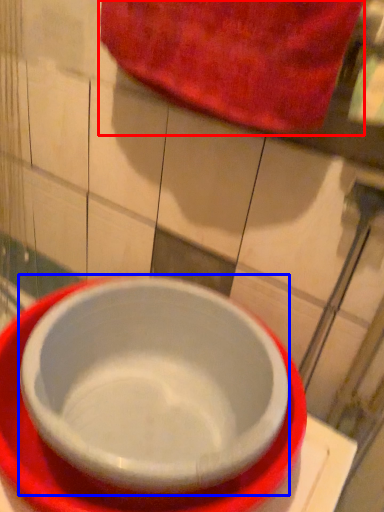
Question: Which object appears closest to the camera in this image, beach towel (highlighted by a red box) or bowl (highlighted by a blue box)?

Choices:
 (A) beach towel
 (B) bowl

Answer: (B)